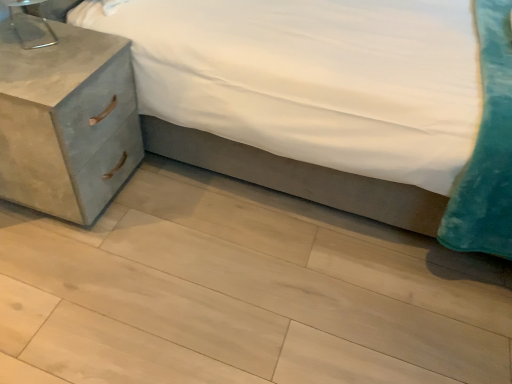
Find the location of a particular element. This screenshot has width=512, height=384. vacant area that is in front of metallic silver table lamp at upper left is located at coordinates (32, 67).